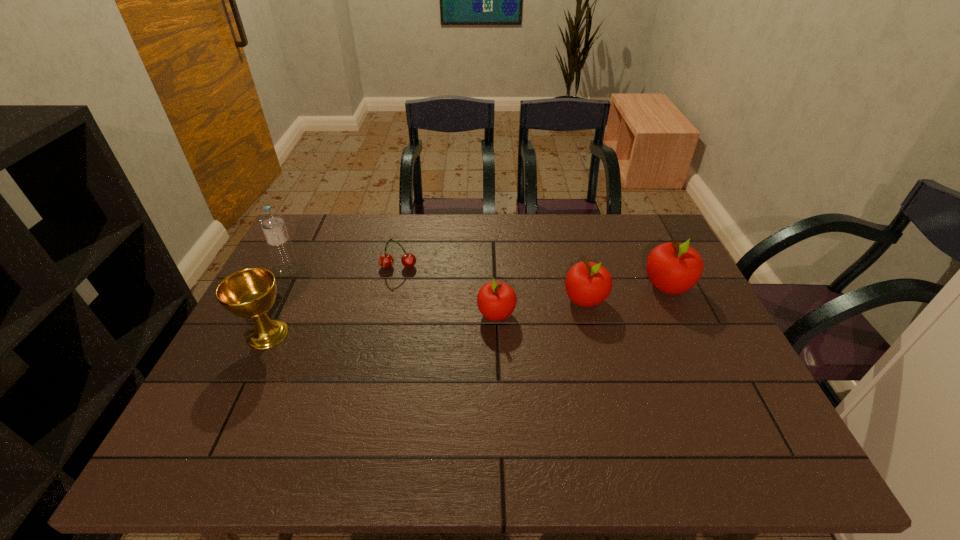
Where is `vacant place for an extra apple on the left`? This screenshot has height=540, width=960. vacant place for an extra apple on the left is located at coordinates (401, 329).